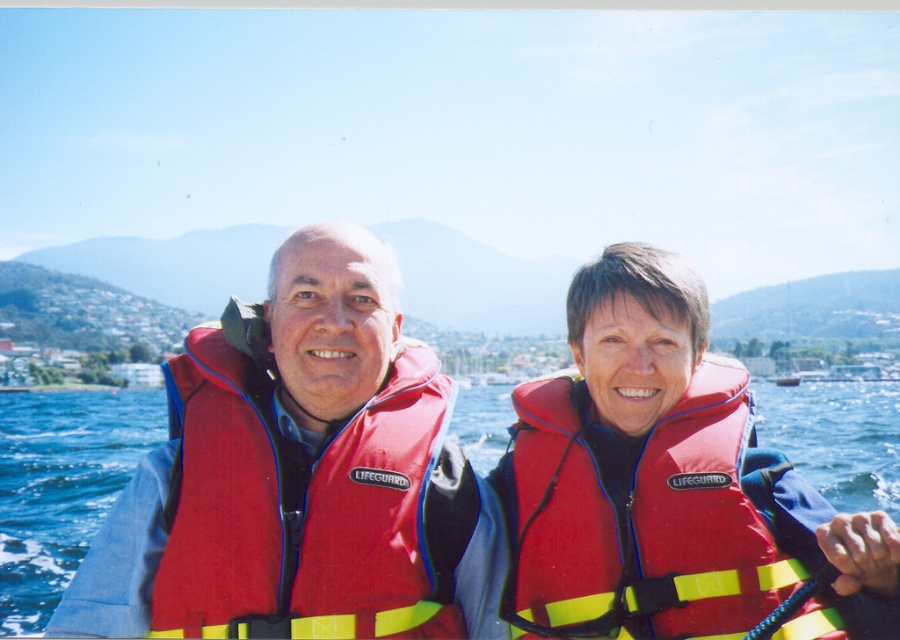
Is red fabric life jacket at center wider than red/yellow fabric life jacket at center?

Indeed, red fabric life jacket at center has a greater width compared to red/yellow fabric life jacket at center.

Who is shorter, red fabric life jacket at center or red/yellow fabric life jacket at center?

With less height is red/yellow fabric life jacket at center.

Who is more distant from viewer, (450,595) or (675,616)?

Positioned behind is point (450,595).

Image resolution: width=900 pixels, height=640 pixels. Find the location of `red fabric life jacket at center`. red fabric life jacket at center is located at coordinates (307, 502).

Can you confirm if red life vest at center is positioned to the right of red/yellow fabric life jacket at center?

In fact, red life vest at center is to the left of red/yellow fabric life jacket at center.

Between point (279, 288) and point (730, 538), which one is positioned behind?

Point (279, 288)

This screenshot has height=640, width=900. I want to click on red life vest at center, so click(x=466, y=481).

Can you confirm if red life vest at center is positioned above red fabric life jacket at center?

Yes, red life vest at center is above red fabric life jacket at center.

The image size is (900, 640). What are the coordinates of `red life vest at center` in the screenshot? It's located at (466, 481).

Identify the location of red life vest at center. The width and height of the screenshot is (900, 640). (466, 481).